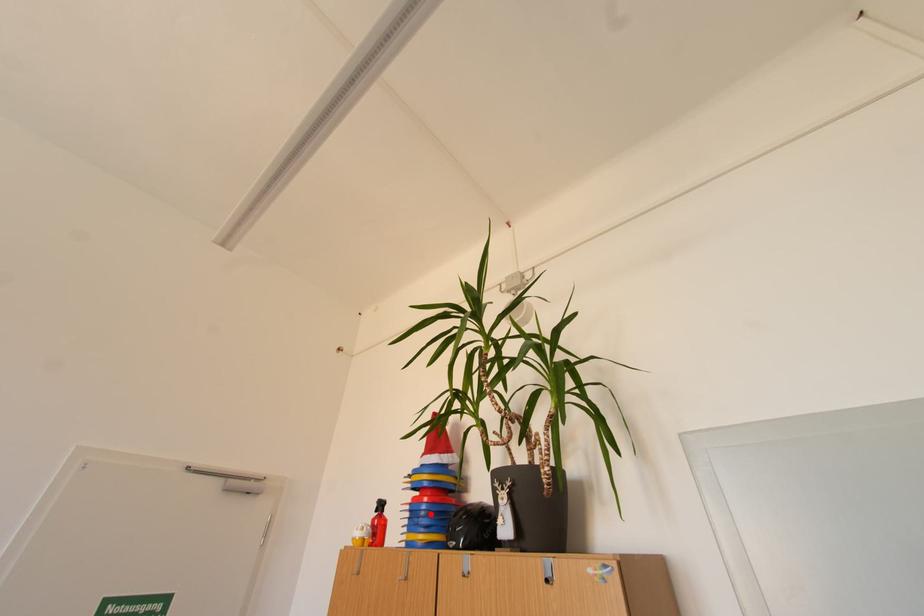
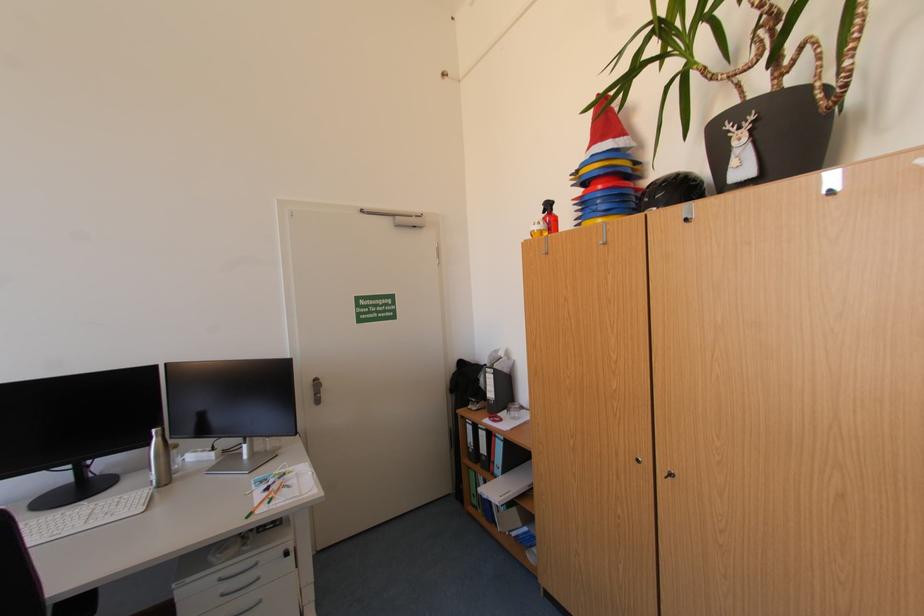
In the second image, find the point that corresponds to the highlighted location in the first image.

(606, 203)